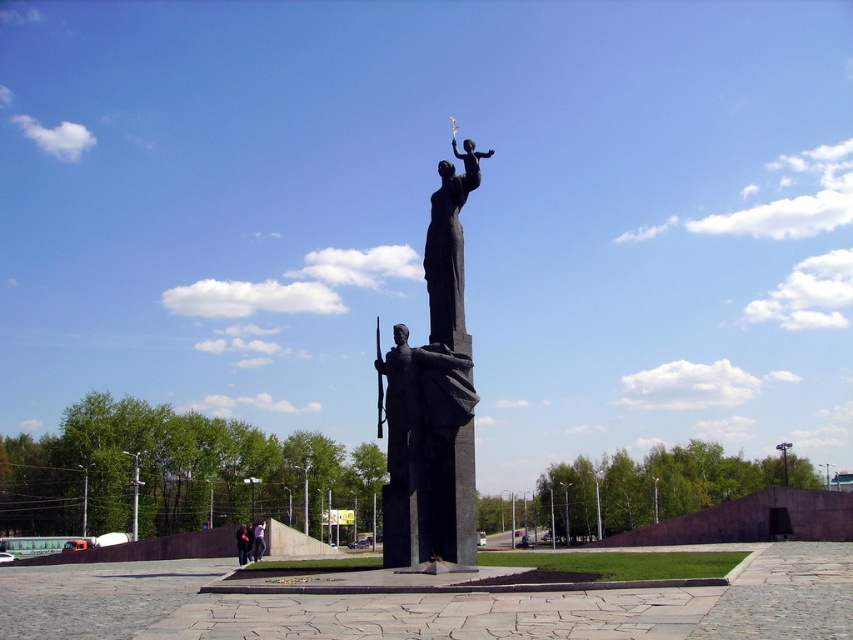
Is point (451, 224) positioned before point (251, 541)?

Yes, point (451, 224) is closer to viewer.

Between polished bronze statue at center and light blue jeans at center, which one is positioned lower?

light blue jeans at center is below.

The image size is (853, 640). Describe the element at coordinates (448, 244) in the screenshot. I see `polished bronze statue at center` at that location.

Locate an element on the screen. The image size is (853, 640). polished bronze statue at center is located at coordinates (448, 244).

Is polished bronze statue at center closer to camera compared to dark blue fabric jacket at center?

Yes, polished bronze statue at center is in front of dark blue fabric jacket at center.

Which is above, polished bronze statue at center or dark blue fabric jacket at center?

polished bronze statue at center

Locate an element on the screen. The width and height of the screenshot is (853, 640). polished bronze statue at center is located at coordinates (448, 244).

Can you confirm if black polished statue at center is smaller than dark blue fabric jacket at center?

No, black polished statue at center is not smaller than dark blue fabric jacket at center.

Is black polished statue at center shorter than dark blue fabric jacket at center?

In fact, black polished statue at center may be taller than dark blue fabric jacket at center.

The height and width of the screenshot is (640, 853). Find the location of `black polished statue at center`. black polished statue at center is located at coordinates (433, 397).

I want to click on black polished statue at center, so pos(433,397).